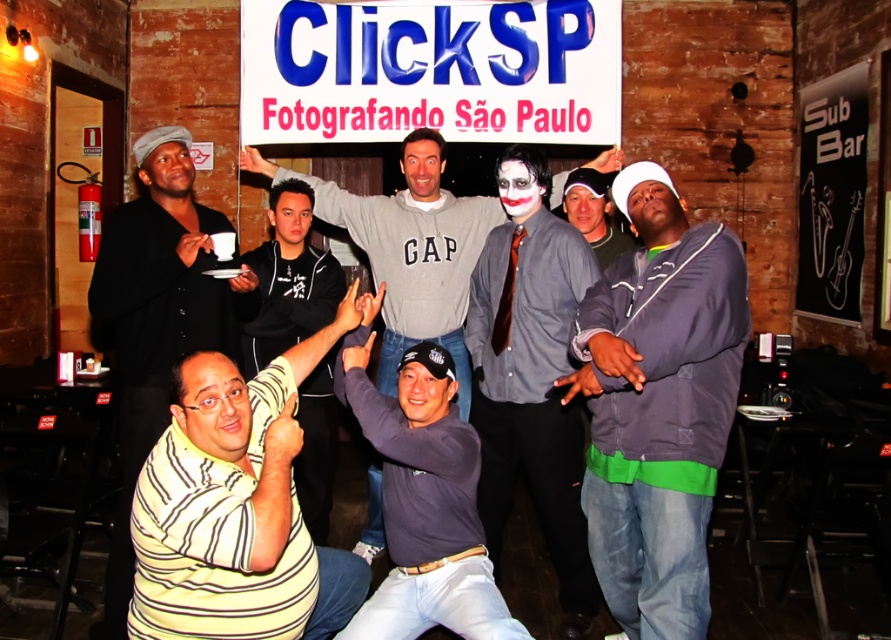
Is blue plastic sign at upper center taller than matte gray shirt at center?

In fact, blue plastic sign at upper center may be shorter than matte gray shirt at center.

Which is behind, point (522, 58) or point (527, 221)?

The point (522, 58) is more distant.

Locate an element on the screen. Image resolution: width=891 pixels, height=640 pixels. blue plastic sign at upper center is located at coordinates (430, 70).

Which is more to the right, yellow striped shirt at lower left or yellow striped shirt at upper left?

yellow striped shirt at lower left

Is yellow striped shirt at lower left below yellow striped shirt at upper left?

Correct, yellow striped shirt at lower left is located below yellow striped shirt at upper left.

At what (x,y) coordinates should I click in order to perform the action: click on yellow striped shirt at lower left. Please return your answer as a coordinate pair (x, y). Looking at the image, I should click on (236, 508).

Locate an element on the screen. This screenshot has height=640, width=891. yellow striped shirt at lower left is located at coordinates (236, 508).

Is point (172, 416) behind point (532, 410)?

No, it is in front of (532, 410).

Can you confirm if yellow striped shirt at lower left is wider than matte gray shirt at center?

Correct, the width of yellow striped shirt at lower left exceeds that of matte gray shirt at center.

Between point (254, 420) and point (518, 154), which one is positioned behind?

The point (518, 154) is more distant.

At what (x,y) coordinates should I click in order to perform the action: click on yellow striped shirt at lower left. Please return your answer as a coordinate pair (x, y). Looking at the image, I should click on (236, 508).